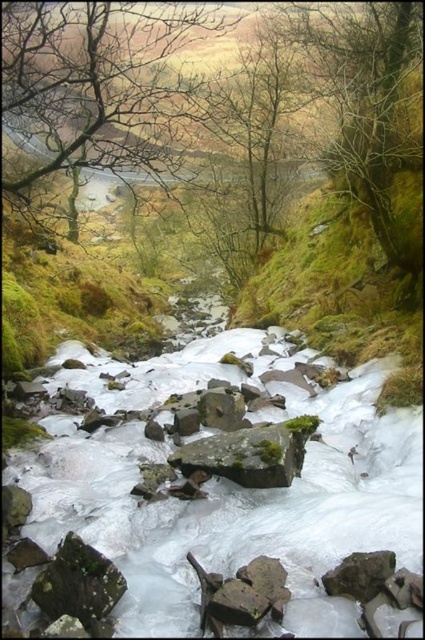
You are a hiker trying to navigate a frozen stream. You see a point marked at coordinates (101, 84). According to the scene, where is this point located?

The point is on a brown leafless tree at upper left.

You are standing at the point closest to the viewer in the image. Which of the two points, point [402,65] or point [333,577], is farther away from you?

Point [402,65] is farther away because it is behind point [333,577], which is closer to the viewer.

You are a hiker trying to cross the stream. You see the white frosty rocks at center. Where are they located in the image?

The white frosty rocks at center are located at point (227, 486) in the image.